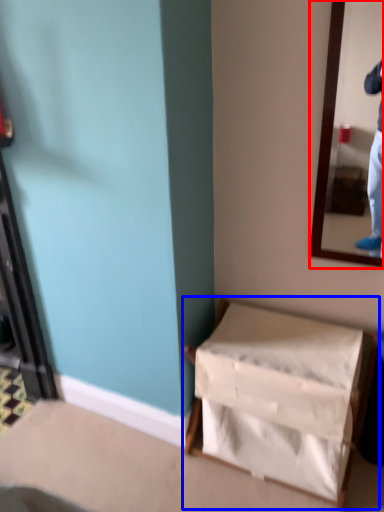
Question: Which object is further to the camera taking this photo, mirror (highlighted by a red box) or furniture (highlighted by a blue box)?

Choices:
 (A) mirror
 (B) furniture

Answer: (B)